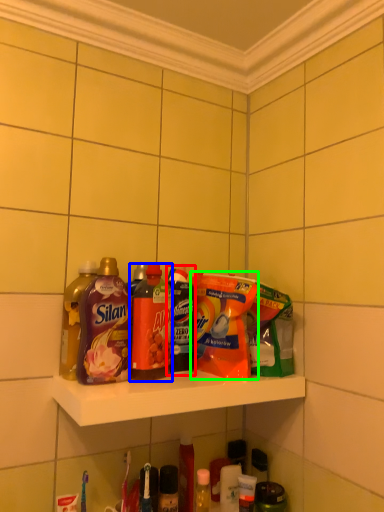
Question: Which object is the closest to the bottle (highlighted by a red box)? Choose among these: bottle (highlighted by a blue box) or cleaning product (highlighted by a green box).

Choices:
 (A) bottle
 (B) cleaning product

Answer: (A)